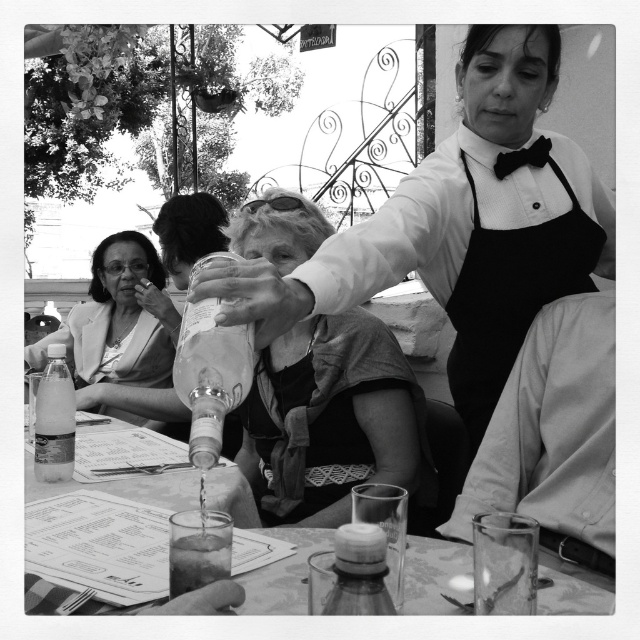
Question: Based on their relative distances, which object is farther from the matte plastic bottle at left?

Choices:
 (A) translucent plastic bottle at lower left
 (B) translucent plastic bottle at center
 (C) clear glass at lower center
 (D) black fabric apron at upper right

Answer: (B)

Question: Estimate the real-world distances between objects in this image. Which object is farther from the matte plastic bottle at left?

Choices:
 (A) black fabric apron at upper right
 (B) translucent plastic bottle at lower left
 (C) translucent glass at table center
 (D) translucent plastic bottle at center

Answer: (D)

Question: Is matte glass bottle at center thinner than clear glass at lower center?

Choices:
 (A) no
 (B) yes

Answer: (A)

Question: Among these points, which one is farthest from the camera?

Choices:
 (A) (305, 540)
 (B) (68, 442)
 (C) (141, 307)

Answer: (C)

Question: In this image, where is clear glass at lower center located relative to translucent plastic bottle at center?

Choices:
 (A) above
 (B) below

Answer: (B)

Question: Is black fabric apron at upper right smaller than matte plastic bottle at left?

Choices:
 (A) no
 (B) yes

Answer: (B)